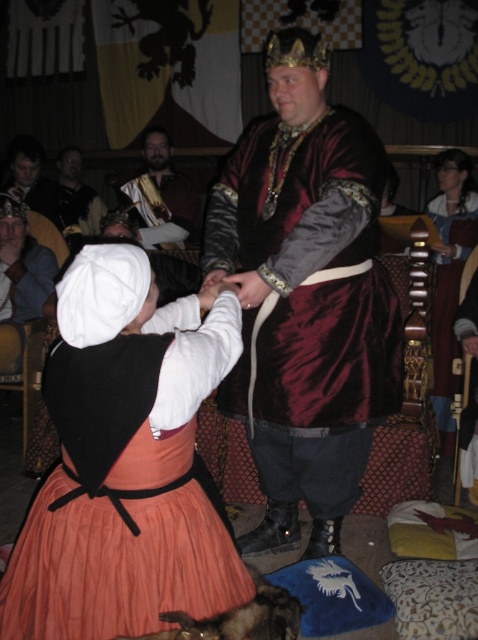
Question: Considering the real-world distances, which object is farthest from the dark brown leather jacket at upper center?

Choices:
 (A) orange pleated fabric dress at lower left
 (B) velvet burgundy vest at center
 (C) gold textured fabric at center

Answer: (A)

Question: Is velvet burgundy vest at center to the right of orange pleated fabric dress at lower left from the viewer's perspective?

Choices:
 (A) no
 (B) yes

Answer: (B)

Question: Which object is the farthest from the velvet burgundy vest at center?

Choices:
 (A) gold textured fabric at center
 (B) orange pleated fabric dress at lower left

Answer: (A)

Question: Is orange pleated fabric dress at lower left bigger than dark brown leather jacket at upper center?

Choices:
 (A) yes
 (B) no

Answer: (B)

Question: Can you confirm if orange pleated fabric dress at lower left is bigger than gold textured fabric at center?

Choices:
 (A) no
 (B) yes

Answer: (A)

Question: Among these objects, which one is nearest to the camera?

Choices:
 (A) orange pleated fabric dress at lower left
 (B) gold textured fabric at center

Answer: (A)